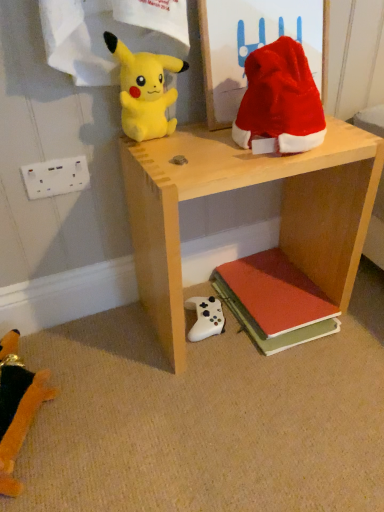
At what (x,y) coordinates should I click in order to perform the action: click on free region on the left part of white matte game controller at lower center, placed as the third toy when sorted from top to bottom. Please return your answer as a coordinate pair (x, y). The height and width of the screenshot is (512, 384). Looking at the image, I should click on (129, 334).